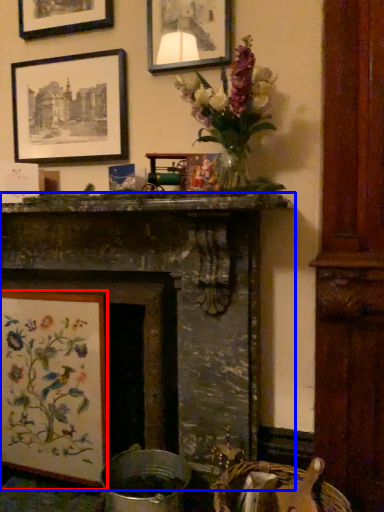
Question: Which point is closer to the camera, picture frame (highlighted by a red box) or fireplace (highlighted by a blue box)?

Choices:
 (A) picture frame
 (B) fireplace

Answer: (B)